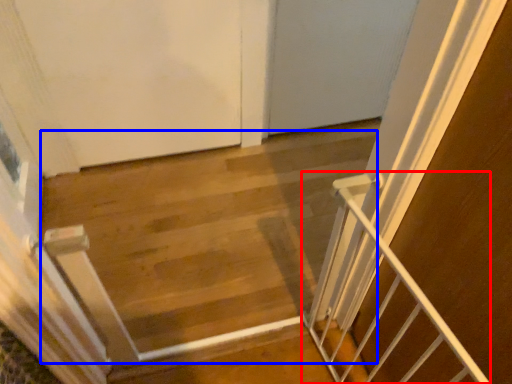
Question: Which of the following is the farthest to the observer, stairs (highlighted by a red box) or stairwell (highlighted by a blue box)?

Choices:
 (A) stairs
 (B) stairwell

Answer: (B)